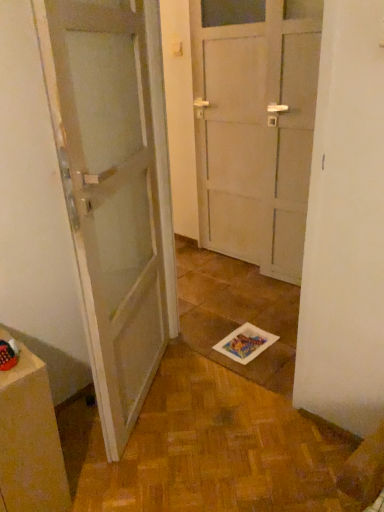
The height and width of the screenshot is (512, 384). I want to click on free location in front of white glossy door at left, so click(165, 464).